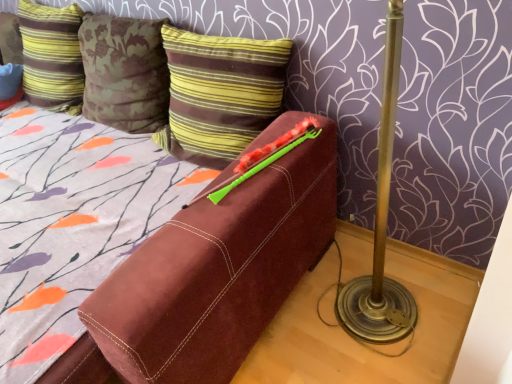
Question: From the image's perspective, relative to brown striped pillow at upper center, the second pillow in the left-to-right sequence, is striped velvet pillow at upper left, which ranks as the 1th pillow in left-to-right order, above or below?

Choices:
 (A) above
 (B) below

Answer: (A)

Question: In the image, is striped velvet pillow at upper left, which is the second pillow from right to left, on the left side or the right side of brown striped pillow at upper center, which is the first pillow from right to left?

Choices:
 (A) left
 (B) right

Answer: (A)

Question: Considering the real-world distances, which object is closest to the brown striped pillow at upper center, the second pillow in the left-to-right sequence?

Choices:
 (A) green plastic crayon at upper center
 (B) striped velvet pillow at upper left, which ranks as the 1th pillow in left-to-right order

Answer: (A)

Question: Which is nearer to the striped velvet pillow at upper left, which is the second pillow from right to left?

Choices:
 (A) green plastic crayon at upper center
 (B) brown striped pillow at upper center, which is the first pillow from right to left

Answer: (B)